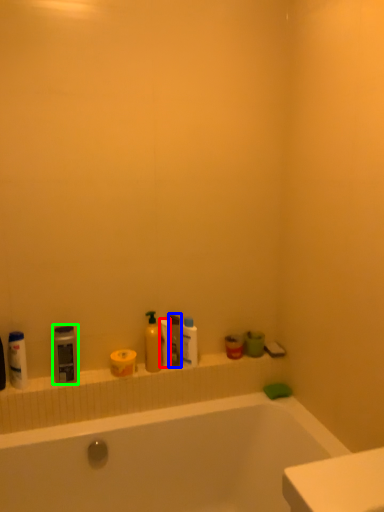
Question: Which object is the closest to the toilet paper (highlighted by a red box)? Choose among these: cleaning product (highlighted by a blue box) or cleaning product (highlighted by a green box).

Choices:
 (A) cleaning product
 (B) cleaning product

Answer: (A)